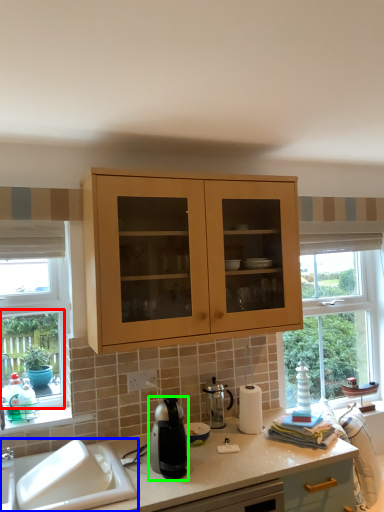
Question: Which object is positioned closest to window frame (highlighted by a red box)? Select from sink (highlighted by a blue box) and kitchen appliance (highlighted by a green box).

Choices:
 (A) sink
 (B) kitchen appliance

Answer: (A)